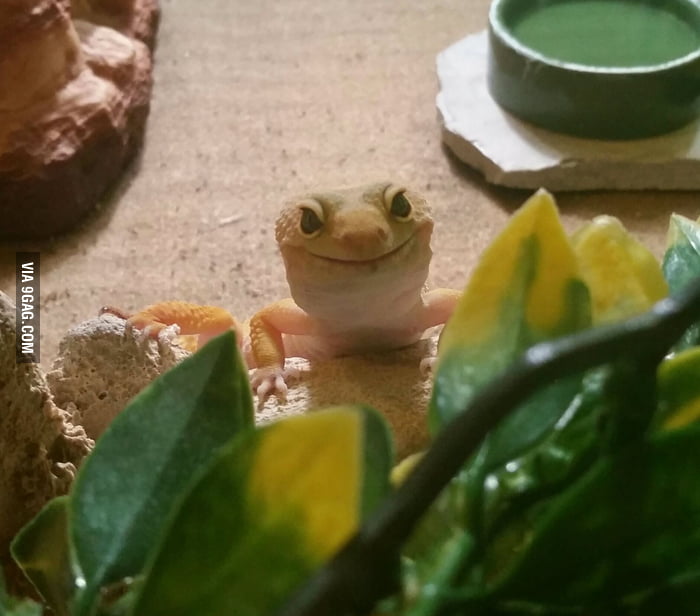
Where is `brown flooring`? Image resolution: width=700 pixels, height=616 pixels. brown flooring is located at coordinates (220, 147).